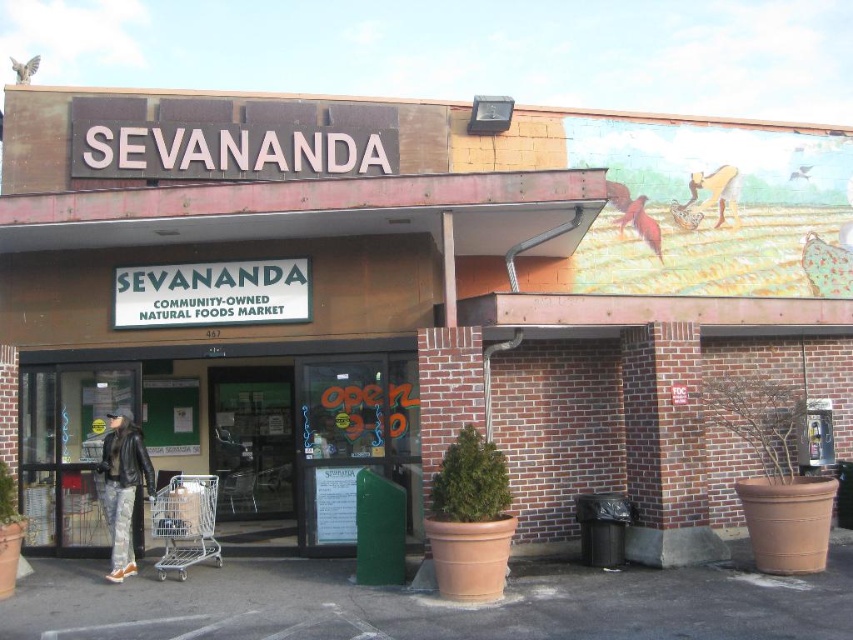
You are standing at the entrance of the store and see both the silver metallic shopping cart at lower left and the leather jacket at lower left. Which object is positioned to the right of the other?

The silver metallic shopping cart at lower left is to the right of the leather jacket at lower left.

You are standing in front of the Sevananda store and see both the metallic shopping cart at center and the silver metallic shopping cart at lower left. Which one is taller?

The metallic shopping cart at center is taller than the silver metallic shopping cart at lower left.

You are standing at the entrance of the store and see the silver metallic shopping cart at lower left. If you want to reach the cart, which direction should you move relative to the entrance?

Since the silver metallic shopping cart at lower left is located at point (184, 522), you should move to the lower left direction from the entrance to reach it.